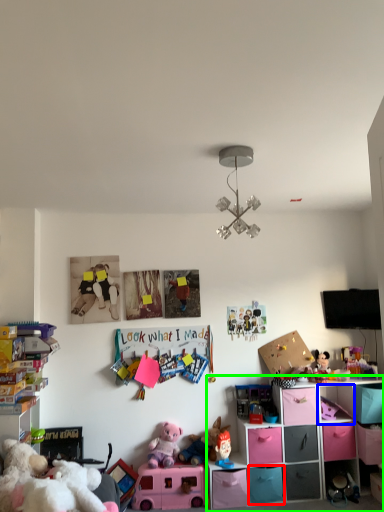
Question: Estimate the real-world distances between objects in this image. Which object is closer to drawer (highlighted by a red box), cabinet (highlighted by a blue box) or shelf (highlighted by a green box)?

Choices:
 (A) cabinet
 (B) shelf

Answer: (B)